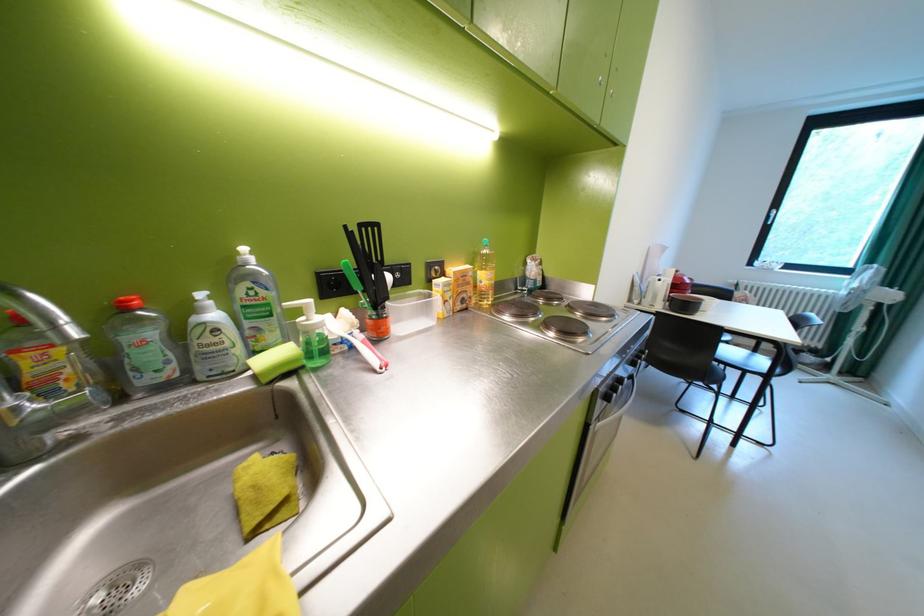
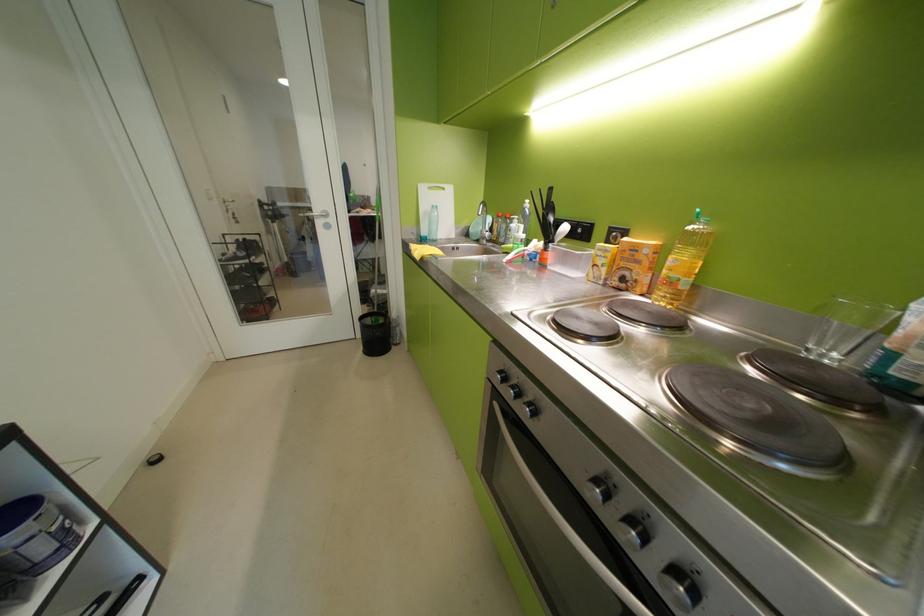
Where in the second image is the point corresponding to (x=475, y=275) from the first image?

(646, 249)